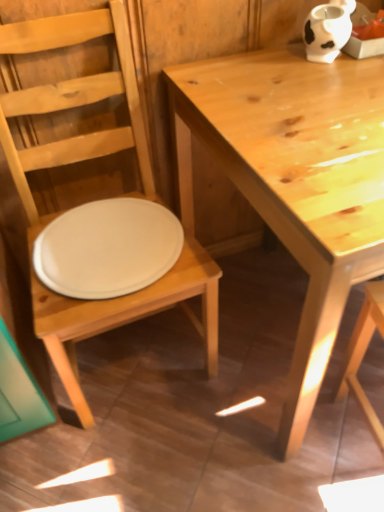
Where is `free space in front of matte white plate at left`? This screenshot has height=512, width=384. free space in front of matte white plate at left is located at coordinates (142, 455).